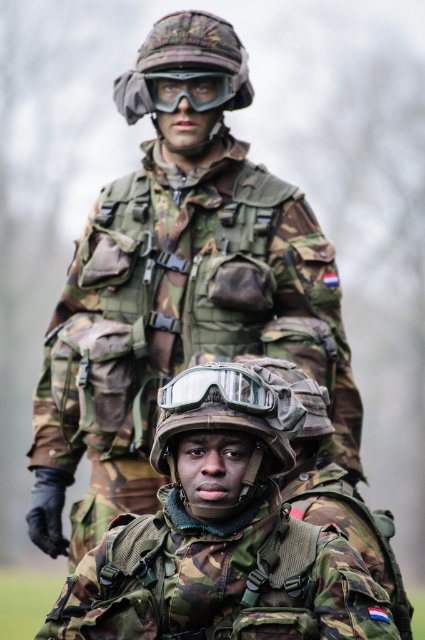
Which is behind, point (269, 582) or point (229, 60)?

Positioned behind is point (229, 60).

Is camouflage fabric helmet at center shorter than camouflage fabric helmet at upper center?

No, camouflage fabric helmet at center is not shorter than camouflage fabric helmet at upper center.

Does point (294, 611) come behind point (187, 64)?

That is False.

Locate an element on the screen. This screenshot has height=640, width=425. camouflage fabric helmet at center is located at coordinates (223, 531).

Who is higher up, camouflage fabric helmet at center or transparent plastic goggles at center?

transparent plastic goggles at center

The width and height of the screenshot is (425, 640). What do you see at coordinates (223, 531) in the screenshot? I see `camouflage fabric helmet at center` at bounding box center [223, 531].

Where is `camouflage fabric helmet at center`? Image resolution: width=425 pixels, height=640 pixels. camouflage fabric helmet at center is located at coordinates (223, 531).

Does point (218, 452) lie in front of point (190, 74)?

Yes, point (218, 452) is in front of point (190, 74).

Is camouflage fabric helmet at center taller than matte black goggles at center?

Yes.

Measure the distance between point (289, 372) and camera.

A distance of 5.43 meters exists between point (289, 372) and camera.

Find the location of `camouflage fabric helmet at center`. camouflage fabric helmet at center is located at coordinates (223, 531).